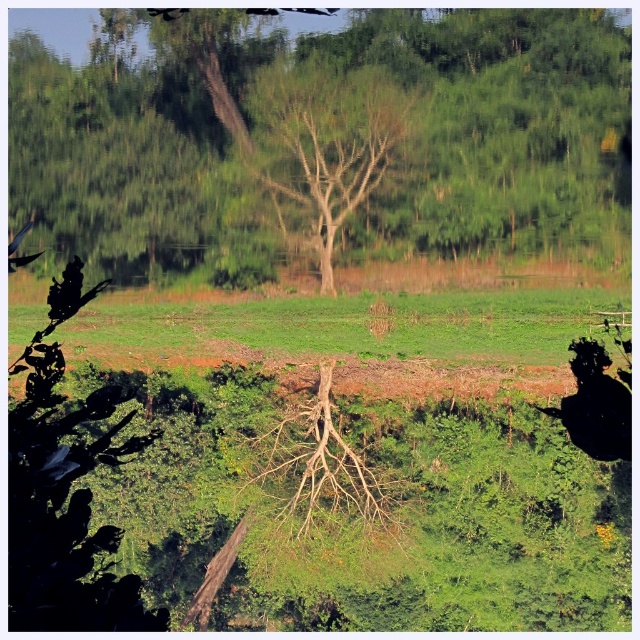
You are a hiker who wants to take a photo of the green leafy tree at center and the green grassy field at center. Which object should you focus on first if you want to capture both in a single frame without moving the camera?

You should focus on the green leafy tree at center first because it is larger than the green grassy field at center, so it will be more prominent in the frame.

You are standing at the origin point of the image coordinate system. You want to walk towards the green leafy tree at center. In which direction should you move?

The green leafy tree at center is located at point (324, 141) in the image coordinate system. Since you are at the origin, you should move towards the positive x and y directions to reach it.